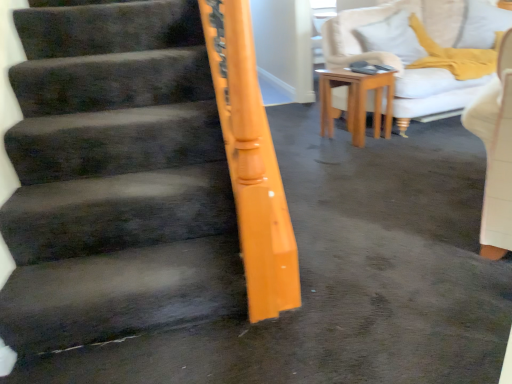
Question: Would you say light brown wooden table at center is inside or outside white soft pillow at upper right?

Choices:
 (A) inside
 (B) outside

Answer: (B)

Question: Is light brown wooden table at center wider or thinner than white soft pillow at upper right?

Choices:
 (A) wide
 (B) thin

Answer: (A)

Question: Is point (325, 71) closer or farther from the camera than point (401, 24)?

Choices:
 (A) farther
 (B) closer

Answer: (B)

Question: Is white soft pillow at upper right inside or outside of light brown wooden table at center?

Choices:
 (A) outside
 (B) inside

Answer: (A)

Question: Is white soft pillow at upper right wider or thinner than light brown wooden table at center?

Choices:
 (A) wide
 (B) thin

Answer: (B)

Question: From the image's perspective, is white soft pillow at upper right positioned above or below light brown wooden table at center?

Choices:
 (A) above
 (B) below

Answer: (A)

Question: Based on their sizes in the image, would you say white soft pillow at upper right is bigger or smaller than light brown wooden table at center?

Choices:
 (A) small
 (B) big

Answer: (B)